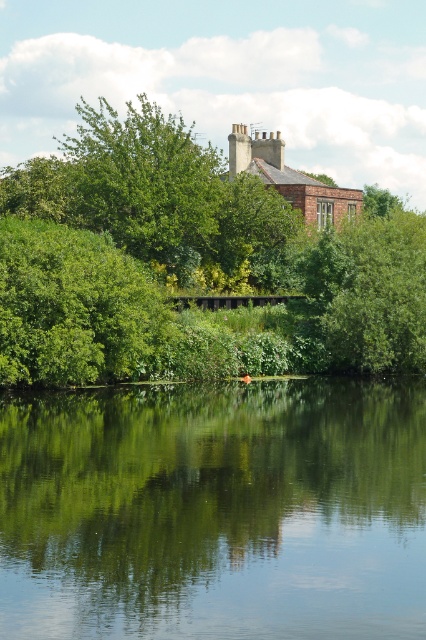
Question: Among these points, which one is farthest from the camera?

Choices:
 (A) (379, 349)
 (B) (316, 344)

Answer: (B)

Question: Can you confirm if green leafy tree at lower left is positioned to the left of green leafy tree at upper center?

Choices:
 (A) no
 (B) yes

Answer: (B)

Question: Does green leafy tree at lower left appear on the left side of green leafy tree at upper center?

Choices:
 (A) no
 (B) yes

Answer: (B)

Question: Does green leafy tree at lower left appear on the right side of green leafy tree at upper center?

Choices:
 (A) no
 (B) yes

Answer: (A)

Question: Among these points, which one is farthest from the camera?

Choices:
 (A) (327, 451)
 (B) (100, 300)

Answer: (B)

Question: Which point is closer to the camera?

Choices:
 (A) (339, 356)
 (B) (293, 570)
 (C) (253, 278)

Answer: (B)